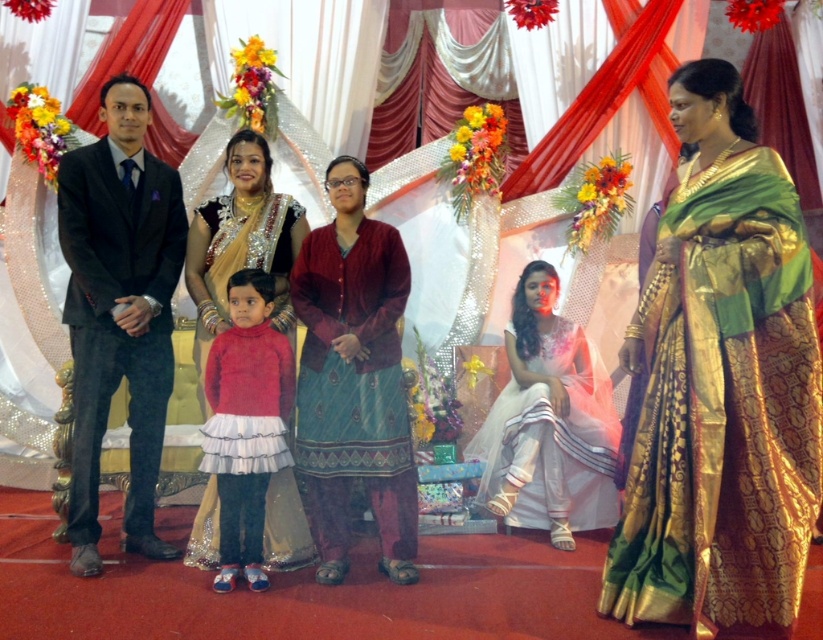
Which of these two, dark gray suit at left or maroon velvet kurta at center, stands shorter?

maroon velvet kurta at center is shorter.

Can you confirm if dark gray suit at left is smaller than maroon velvet kurta at center?

No.

Which is behind, point (105, 413) or point (356, 252)?

Point (356, 252)

At what (x,y) coordinates should I click in order to perform the action: click on dark gray suit at left. Please return your answer as a coordinate pair (x, y). This screenshot has height=640, width=823. Looking at the image, I should click on (119, 310).

Which of these two, maroon velvet kurta at center or matte red sweater at center, stands taller?

maroon velvet kurta at center is taller.

Describe the element at coordinates (352, 380) in the screenshot. This screenshot has width=823, height=640. I see `maroon velvet kurta at center` at that location.

This screenshot has height=640, width=823. What are the coordinates of `maroon velvet kurta at center` in the screenshot? It's located at (352, 380).

You are a GUI agent. You are given a task and a screenshot of the screen. Output one action in this format:
    pyautogui.click(x=<x>, y=<y>)
    Task: Click on the green silk saree at center
    The width and height of the screenshot is (823, 640).
    Given the screenshot: What is the action you would take?
    pyautogui.click(x=721, y=387)

Does green silk saree at center come in front of matte red sweater at center?

Yes, green silk saree at center is closer to the viewer.

This screenshot has width=823, height=640. Find the location of `green silk saree at center`. green silk saree at center is located at coordinates (721, 387).

At what (x,y) coordinates should I click in order to perform the action: click on green silk saree at center. Please return your answer as a coordinate pair (x, y). This screenshot has width=823, height=640. Looking at the image, I should click on (721, 387).